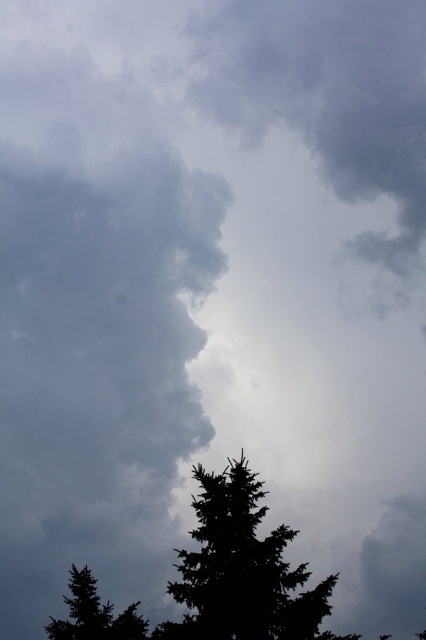
You are an observer looking at the sky scene. You notice the black matte tree at center and the green matte tree at lower left. Which tree is positioned more to the right side of the image?

The black matte tree at center is positioned more to the right side of the image compared to the green matte tree at lower left.

You are an ornithologist observing birds in this scene. You notice two trees, the black matte tree at center and the green matte tree at lower left. Which tree would you estimate to be taller based on their sizes in the image?

The black matte tree at center has a larger size compared to the green matte tree at lower left, so it is likely taller.